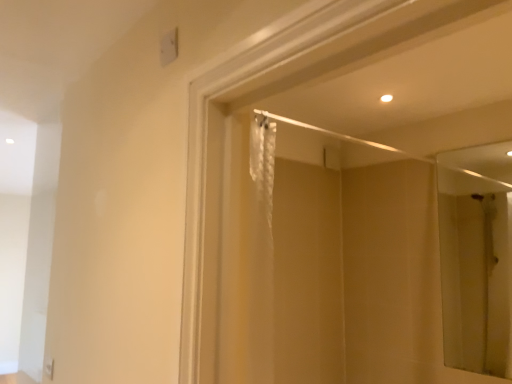
Describe the element at coordinates (475, 273) in the screenshot. I see `clear glass mirror at upper right` at that location.

Where is `clear glass mirror at upper right`? The width and height of the screenshot is (512, 384). clear glass mirror at upper right is located at coordinates (475, 273).

Find the location of a particular element. Image resolution: width=512 pixels, height=384 pixels. clear glass mirror at upper right is located at coordinates (475, 273).